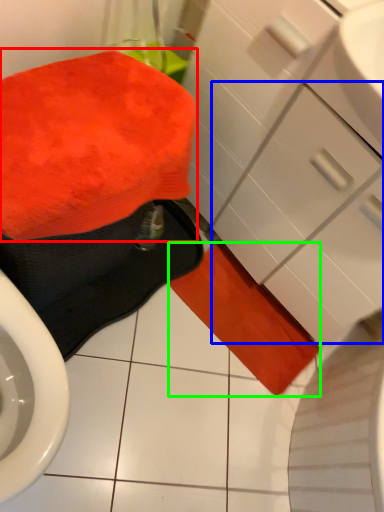
Question: Which object is positioned closest to bath towel (highlighted by a red box)? Select from drawer (highlighted by a blue box) and bath towel (highlighted by a green box).

Choices:
 (A) drawer
 (B) bath towel

Answer: (A)